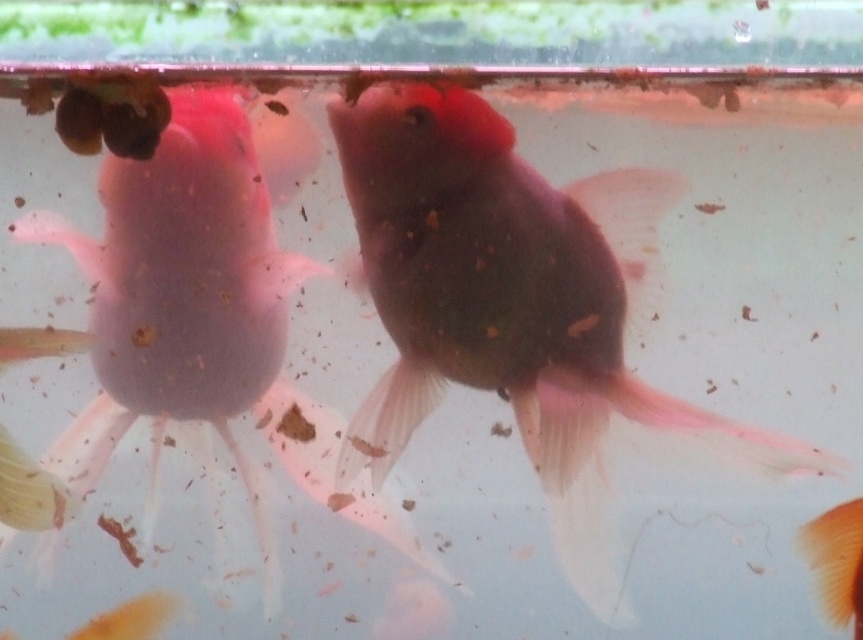
Based on the photo, does matte pink goldfish at center have a larger size compared to pink translucent fish at left?

Correct, matte pink goldfish at center is larger in size than pink translucent fish at left.

What do you see at coordinates (515, 307) in the screenshot? This screenshot has height=640, width=863. I see `matte pink goldfish at center` at bounding box center [515, 307].

This screenshot has width=863, height=640. I want to click on matte pink goldfish at center, so click(x=515, y=307).